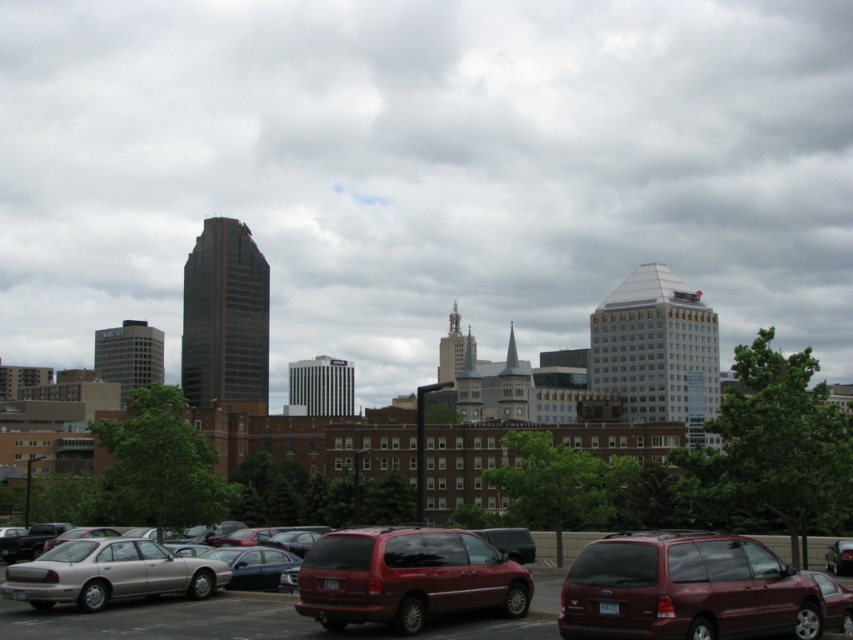
Is maroon matte minivan at center in front of silver metallic sedan at lower left?

Yes.

What do you see at coordinates (685, 589) in the screenshot? I see `maroon matte minivan at center` at bounding box center [685, 589].

Between point (602, 589) and point (96, 611), which one is positioned behind?

The point (96, 611) is more distant.

Locate an element on the screen. The image size is (853, 640). maroon matte minivan at center is located at coordinates (685, 589).

From the picture: Can you confirm if silver metallic sedan at lower left is wider than metallic silver van at lower right?

Yes.

Does silver metallic sedan at lower left have a greater height compared to metallic silver van at lower right?

Incorrect, silver metallic sedan at lower left's height is not larger of metallic silver van at lower right's.

Between point (48, 550) and point (834, 560), which one is positioned in front?

Point (48, 550) is in front.

Where is `silver metallic sedan at lower left`? silver metallic sedan at lower left is located at coordinates (109, 573).

Between shiny maroon minivan at center and metallic silver van at lower right, which one appears on the left side from the viewer's perspective?

shiny maroon minivan at center

Looking at this image, which of these two, shiny maroon minivan at center or metallic silver van at lower right, stands shorter?

Standing shorter between the two is metallic silver van at lower right.

Is point (326, 579) behind point (837, 544)?

No, it is in front of (837, 544).

What are the coordinates of `shiny maroon minivan at center` in the screenshot? It's located at (405, 577).